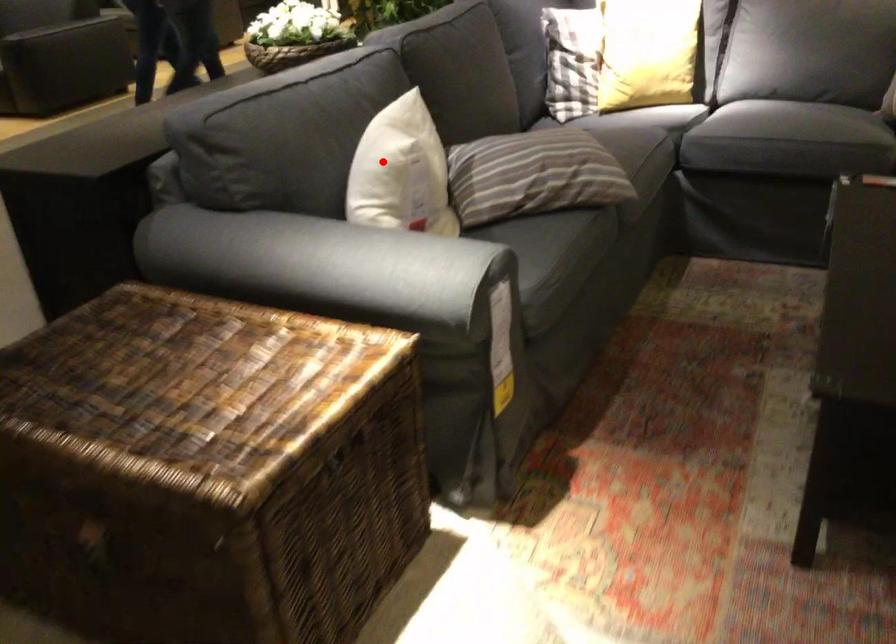
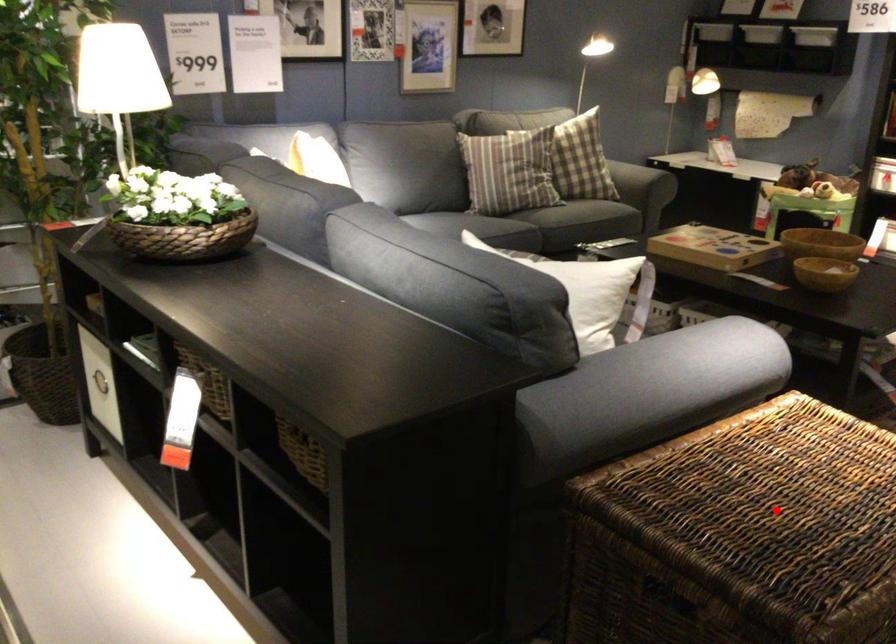
I am providing you with two images of the same scene from different viewpoints. A red point is marked on the first image and another point is marked on the second image. Do the highlighted points in image1 and image2 indicate the same real-world spot?

No